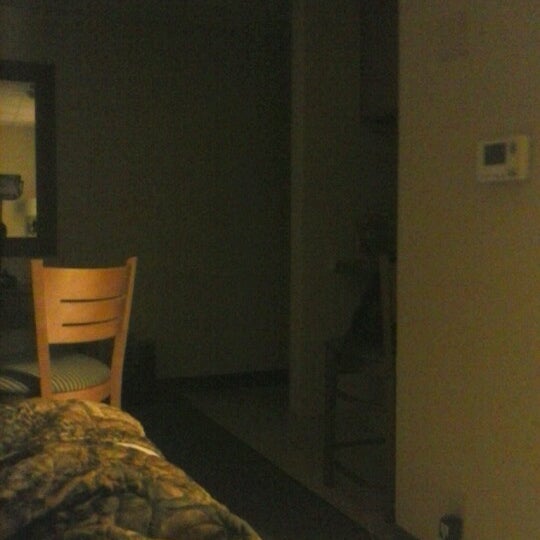
Where is `mirror`? The image size is (540, 540). mirror is located at coordinates (23, 195), (24, 120).